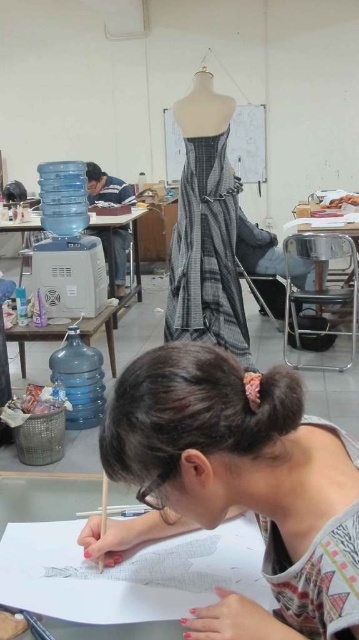
Question: Is matte gray dress at center above striped fabric dress at center?

Choices:
 (A) no
 (B) yes

Answer: (A)

Question: Is matte gray dress at center wider than matte plastic table at lower left?

Choices:
 (A) yes
 (B) no

Answer: (B)

Question: Can you confirm if matte gray dress at center is positioned to the left of white paper at lower center?

Choices:
 (A) yes
 (B) no

Answer: (B)

Question: Among these objects, which one is farthest from the camera?

Choices:
 (A) matte gray dress at center
 (B) white paper at lower center
 (C) plastic gray table at left

Answer: (C)

Question: Which point appears closest to the camera in this image?

Choices:
 (A) (230, 506)
 (B) (25, 224)

Answer: (A)

Question: Which of the following is the farthest from the observer?

Choices:
 (A) striped fabric dress at center
 (B) white paper at lower center
 (C) matte plastic table at lower left

Answer: (C)